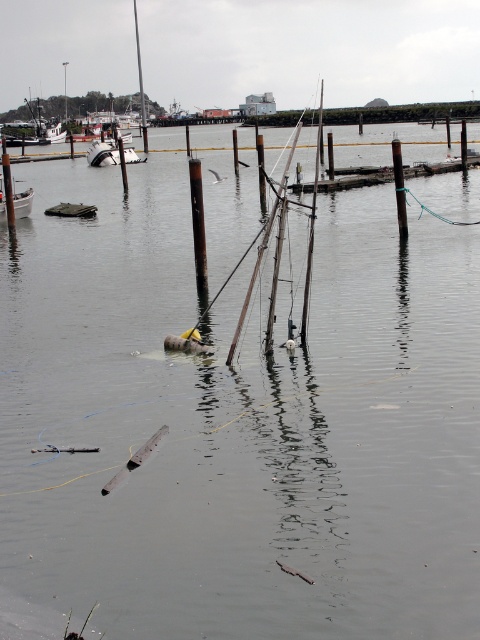
Question: Can you confirm if rusty metal barrel at center is positioned to the right of white plastic boat at left?

Choices:
 (A) yes
 (B) no

Answer: (A)

Question: Which object is positioned closest to the rusty metal barrel at center?

Choices:
 (A) white plastic boat at left
 (B) white matte boat at upper left

Answer: (B)

Question: Which object is positioned farthest from the white matte boat at upper left?

Choices:
 (A) rusty metal barrel at center
 (B) white plastic boat at left

Answer: (B)

Question: Does rusty metal barrel at center have a lesser width compared to white matte boat at upper left?

Choices:
 (A) no
 (B) yes

Answer: (A)

Question: Which of the following is the closest to the observer?

Choices:
 (A) white plastic boat at left
 (B) white matte boat at upper left
 (C) rusty metal barrel at center

Answer: (C)

Question: Can you confirm if rusty metal barrel at center is positioned below white plastic boat at left?

Choices:
 (A) yes
 (B) no

Answer: (B)